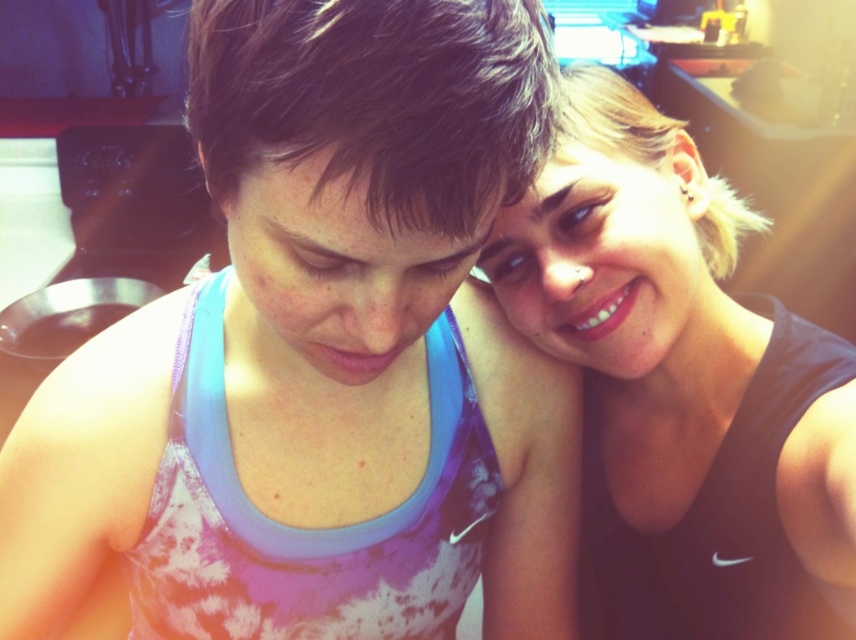
This screenshot has height=640, width=856. Describe the element at coordinates (321, 355) in the screenshot. I see `matte blue tank top at upper right` at that location.

Is the position of matte blue tank top at upper right more distant than that of matte black tank top at upper right?

That is False.

Identify the location of matte blue tank top at upper right. (321, 355).